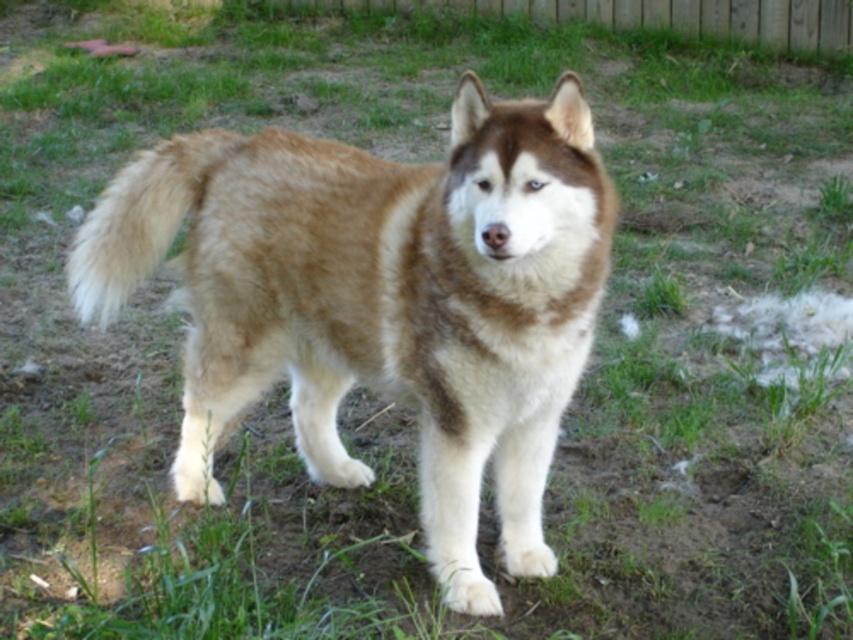
Based on the scene description, where is the fuzzy brown fur at rear located in relation to the wooden fence at upper center?

The fuzzy brown fur at rear is to the left of the wooden fence at upper center.